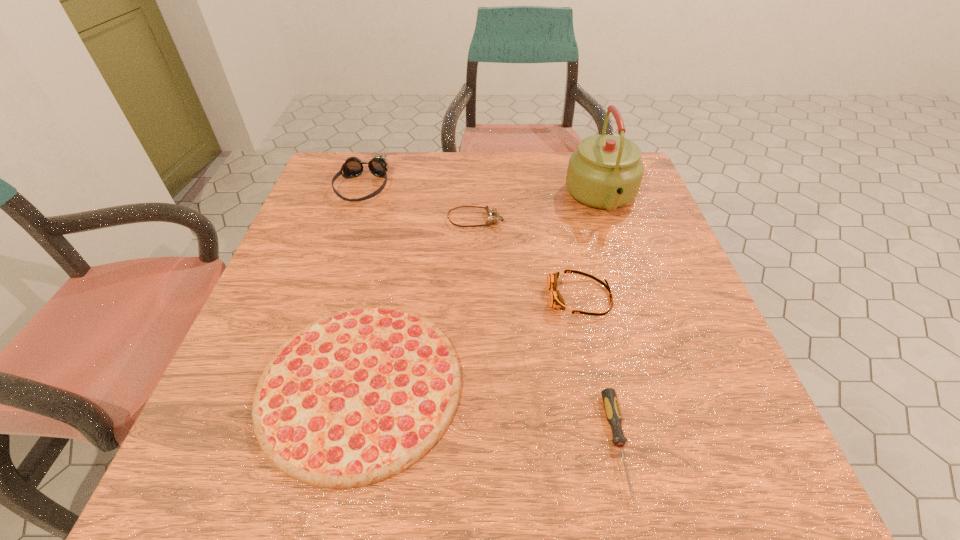
This screenshot has height=540, width=960. I want to click on free space at the near right corner of the desktop, so click(x=701, y=443).

Find the location of `vacant area between the screwdriver and the second tallest object`. vacant area between the screwdriver and the second tallest object is located at coordinates (490, 315).

The height and width of the screenshot is (540, 960). Find the location of `empty space that is in between the pizza and the screwdriver`. empty space that is in between the pizza and the screwdriver is located at coordinates (490, 414).

Identify the location of vacant space in between the tallest object and the rightmost goggles. Image resolution: width=960 pixels, height=540 pixels. (590, 248).

I want to click on vacant area between the screwdriver and the fifth shortest object, so click(x=490, y=315).

Find the location of a particular element. The height and width of the screenshot is (540, 960). vacant region between the fifth shortest object and the pizza is located at coordinates (362, 286).

Locate an element on the screen. vacant space that's between the pizza and the shortest goggles is located at coordinates (419, 302).

Where is `free space between the screwdriver and the pizza`? The width and height of the screenshot is (960, 540). free space between the screwdriver and the pizza is located at coordinates (490, 414).

Where is `unoccupied position between the tallest goggles and the kettle`? This screenshot has height=540, width=960. unoccupied position between the tallest goggles and the kettle is located at coordinates (482, 192).

Locate an element on the screen. empty space between the fourth shortest object and the pizza is located at coordinates (470, 341).